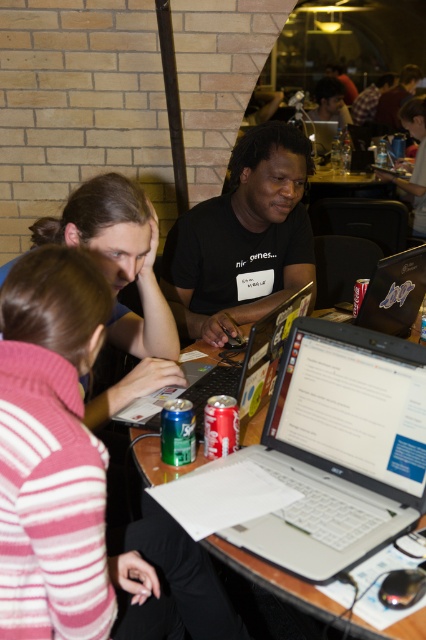
Question: Which of the following is the farthest from the observer?

Choices:
 (A) (187, 212)
 (B) (267, 342)
 (C) (137, 468)
 (D) (420, 269)

Answer: (A)

Question: Estimate the real-world distances between objects in this image. Which object is closer to the glossy plastic laptop at center?

Choices:
 (A) wooden table at center
 (B) black matte shirt at center
 (C) silver metallic laptop at center

Answer: (C)

Question: From the image, what is the correct spatial relationship of black matte shirt at center in relation to silver metallic laptop at center?

Choices:
 (A) right
 (B) left

Answer: (A)

Question: Considering the relative positions of black matte shirt at center and glossy plastic laptop at center in the image provided, where is black matte shirt at center located with respect to glossy plastic laptop at center?

Choices:
 (A) above
 (B) below

Answer: (A)

Question: Is black matte shirt at center to the left of glossy plastic laptop at center from the viewer's perspective?

Choices:
 (A) no
 (B) yes

Answer: (B)

Question: Which of these objects is positioned farthest from the silver metallic laptop at center?

Choices:
 (A) glossy plastic laptop at center
 (B) black matte shirt at center
 (C) wooden table at center

Answer: (B)